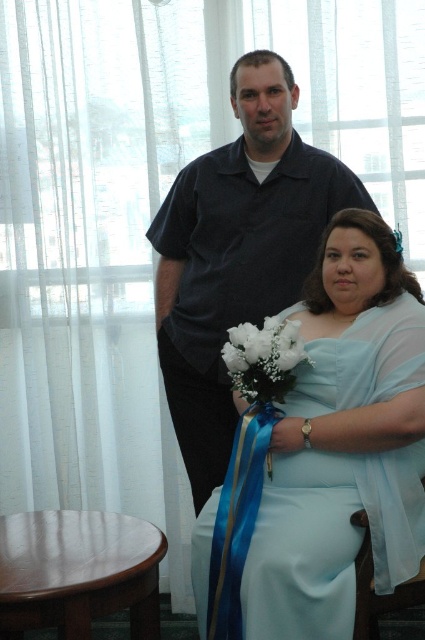
Who is higher up, matte black shirt at upper center or brown wooden stool at lower left?

matte black shirt at upper center

In the scene shown: Does matte black shirt at upper center come behind brown wooden stool at lower left?

Yes.

Is point (232, 97) behind point (5, 568)?

That is True.

This screenshot has width=425, height=640. I want to click on matte black shirt at upper center, so click(x=237, y=253).

Does brown wooden stool at lower left come behind white silk bouquet at lower center?

That is False.

Between brown wooden stool at lower left and white silk bouquet at lower center, which one appears on the right side from the viewer's perspective?

white silk bouquet at lower center

At what (x,y) coordinates should I click in order to perform the action: click on brown wooden stool at lower left. Please return your answer as a coordinate pair (x, y). The image size is (425, 640). Looking at the image, I should click on (78, 572).

Locate an element on the screen. The image size is (425, 640). brown wooden stool at lower left is located at coordinates (78, 572).

Who is lower down, blue satin ribbon at lower center or white silk bouquet at lower center?

Positioned lower is blue satin ribbon at lower center.

From the picture: Is blue satin ribbon at lower center to the left of white silk bouquet at lower center from the viewer's perspective?

Indeed, blue satin ribbon at lower center is positioned on the left side of white silk bouquet at lower center.

What do you see at coordinates (238, 518) in the screenshot?
I see `blue satin ribbon at lower center` at bounding box center [238, 518].

The height and width of the screenshot is (640, 425). What are the coordinates of `blue satin ribbon at lower center` in the screenshot? It's located at (238, 518).